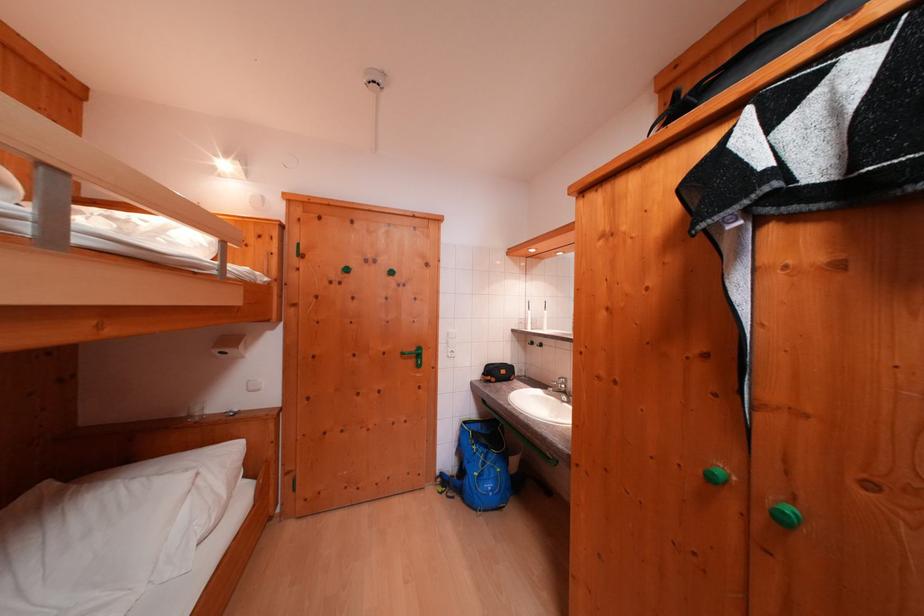
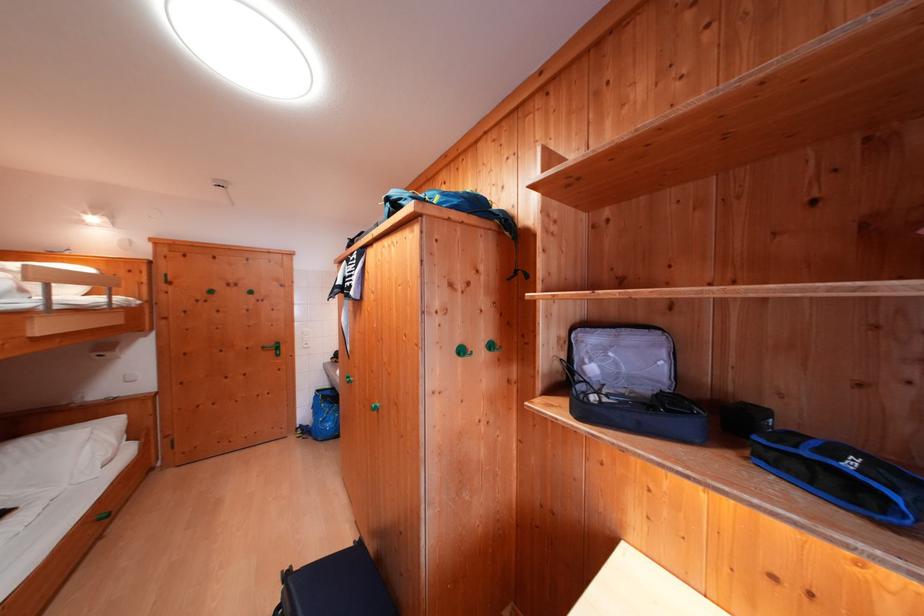
Find the pixel in the second image that matches point (199, 477) in the first image.

(96, 434)